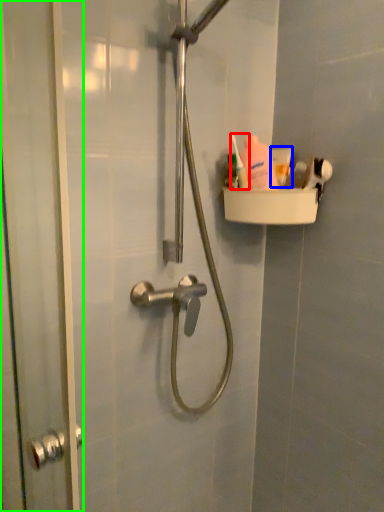
Question: Which object is positioned farthest from toiletry (highlighted by a red box)? Select from toothpaste (highlighted by a blue box) and screen door (highlighted by a green box).

Choices:
 (A) toothpaste
 (B) screen door

Answer: (B)